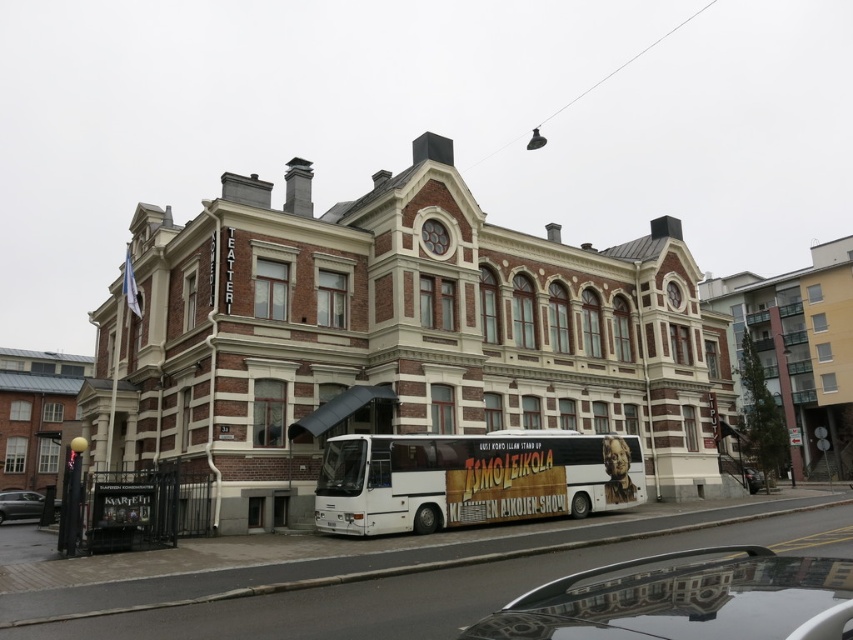
Question: Which point is closer to the camera?

Choices:
 (A) white matte bus at lower center
 (B) silver metallic car at center
 (C) metallic silver car at lower left

Answer: (B)

Question: Estimate the real-world distances between objects in this image. Which object is farther from the silver metallic car at center?

Choices:
 (A) shiny black car at lower right
 (B) metallic silver car at lower left
 (C) white matte bus at lower center

Answer: (B)

Question: Where is white matte bus at lower center located in relation to silver metallic car at center in the image?

Choices:
 (A) above
 (B) below

Answer: (B)

Question: Can you confirm if silver metallic car at center is thinner than metallic silver car at lower left?

Choices:
 (A) no
 (B) yes

Answer: (A)

Question: Which point is farther from the camera taking this photo?

Choices:
 (A) (16, 493)
 (B) (796, 602)
 (C) (320, 481)

Answer: (A)

Question: Is silver metallic car at center above metallic silver car at lower left?

Choices:
 (A) no
 (B) yes

Answer: (B)